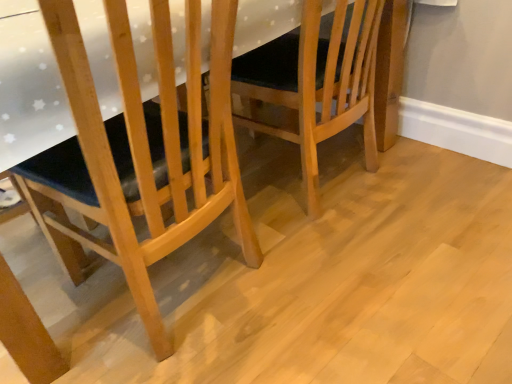
Question: In the image, is light brown wooden chair at center, which is the 1th chair from right to left, positioned in front of or behind natural wood chair at left, acting as the 1th chair starting from the left?

Choices:
 (A) behind
 (B) front

Answer: (A)

Question: Considering the positions of light brown wooden chair at center, which is the 1th chair from right to left, and natural wood chair at left, acting as the 1th chair starting from the left, in the image, is light brown wooden chair at center, which is the 1th chair from right to left, bigger or smaller than natural wood chair at left, acting as the 1th chair starting from the left,?

Choices:
 (A) big
 (B) small

Answer: (B)

Question: Visually, is light brown wooden chair at center, placed as the second chair when sorted from left to right, positioned to the left or to the right of natural wood chair at left, the 2th chair from the right?

Choices:
 (A) left
 (B) right

Answer: (B)

Question: In terms of width, does natural wood chair at left, the 2th chair from the right, look wider or thinner when compared to light brown wooden chair at center, placed as the second chair when sorted from left to right?

Choices:
 (A) wide
 (B) thin

Answer: (B)

Question: Relative to light brown wooden chair at center, placed as the second chair when sorted from left to right, is natural wood chair at left, the 2th chair from the right, in front or behind?

Choices:
 (A) behind
 (B) front

Answer: (B)

Question: From the image's perspective, is natural wood chair at left, acting as the 1th chair starting from the left, located above or below light brown wooden chair at center, placed as the second chair when sorted from left to right?

Choices:
 (A) below
 (B) above

Answer: (A)

Question: Is point (112, 256) positioned closer to the camera than point (335, 127)?

Choices:
 (A) closer
 (B) farther

Answer: (A)